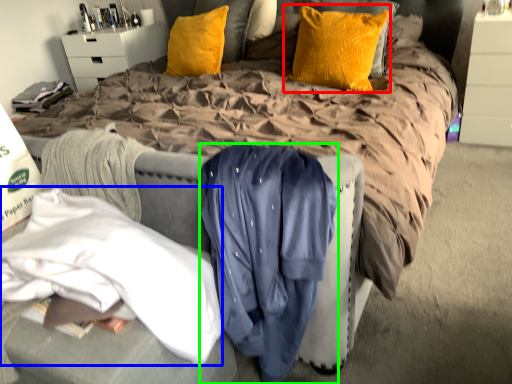
Question: Considering the real-world distances, which object is closest to pillow (highlighted by a red box)? clothing (highlighted by a blue box) or clothing (highlighted by a green box).

Choices:
 (A) clothing
 (B) clothing

Answer: (B)